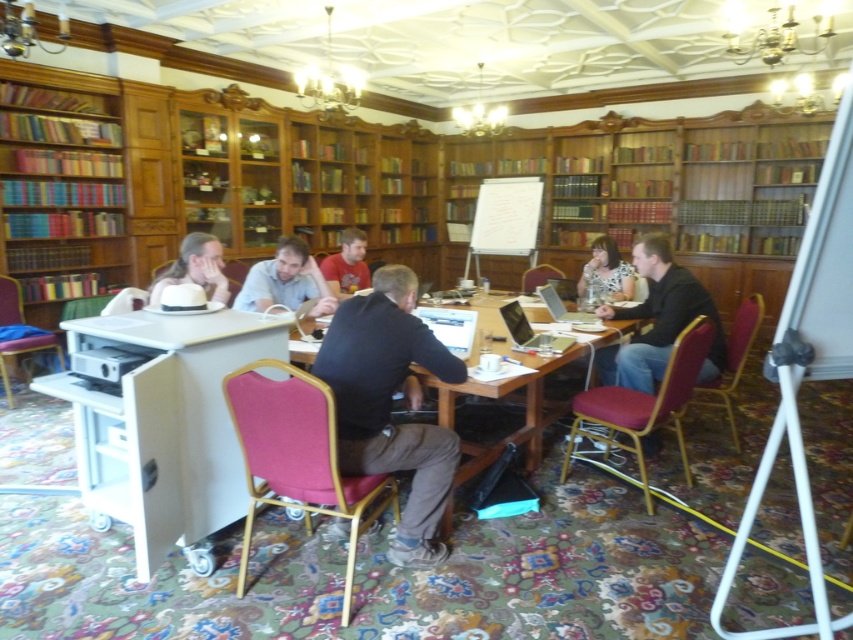
You are a photographer taking a portrait of the matte white hat at center and light brown hair at center. Which object should you focus on first if you want to capture both in the frame without moving the camera?

The matte white hat at center is positioned on the left side of light brown hair at center, so you should focus on the matte white hat at center first to ensure both are in frame without moving the camera.

You are standing in a library and see the wooden table at center. If you want to place a 2.0 meter long banner across the table, will it fit? Please consider the table length and the banner length.

The wooden table at center is 1.96 meters from viewer. Since the banner is 2.0 meters long, it will not fit entirely on the table as the table is shorter than the banner.

You are a participant in a meeting at the wooden table at center. You need to pass a note to the person with light brown hair at center. In which direction should you move to reach them?

The wooden table at center is to the left of light brown hair at center, so you should move to your right to reach them.